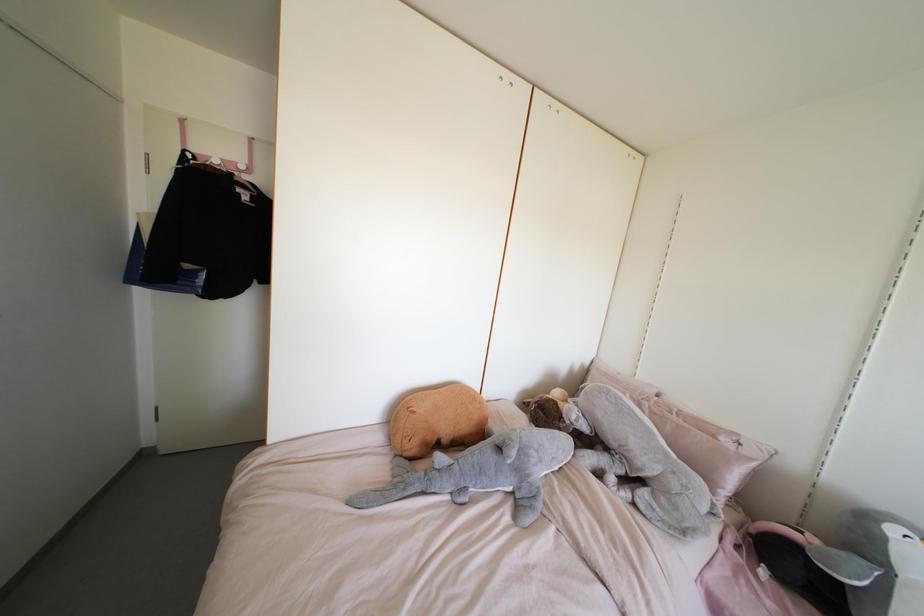
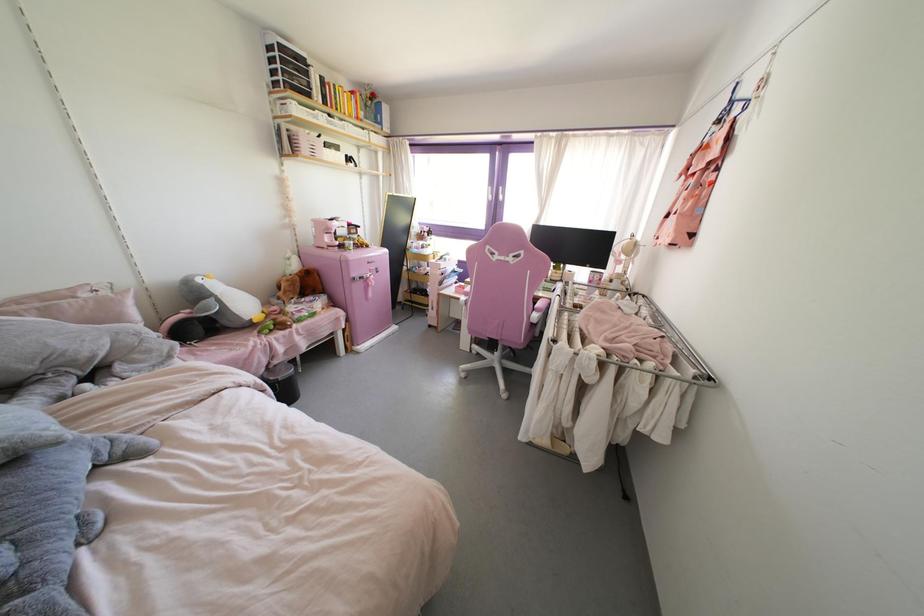
In the second image, find the point that corresponds to (x=722, y=439) in the first image.

(83, 294)